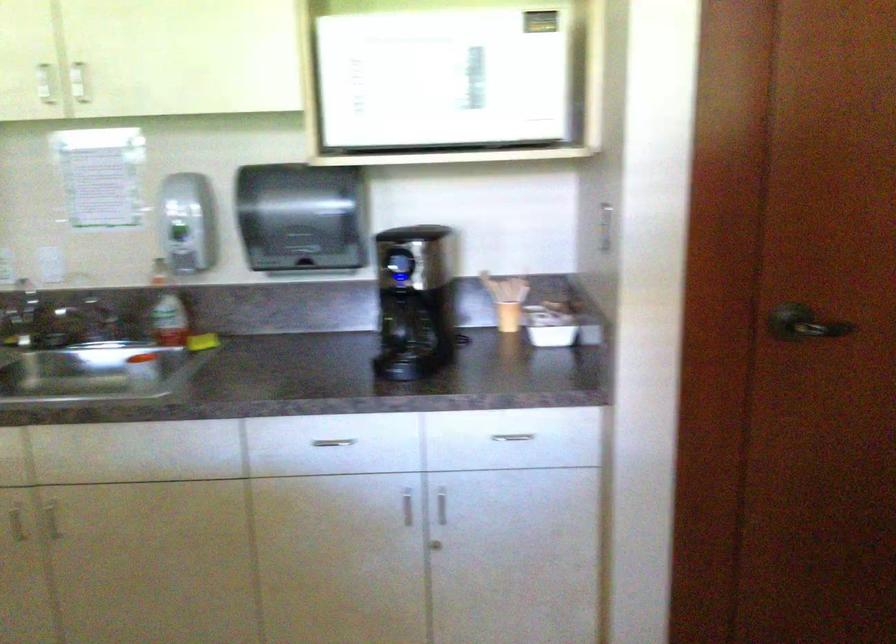
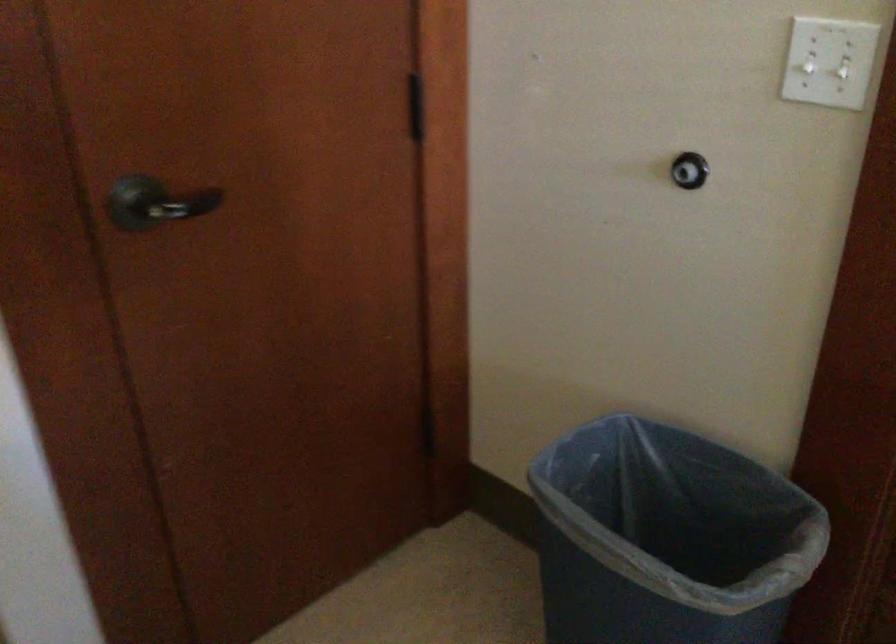
The images are taken continuously from a first-person perspective. In which direction is your viewpoint rotating?

The rotation direction of the camera is right-down.